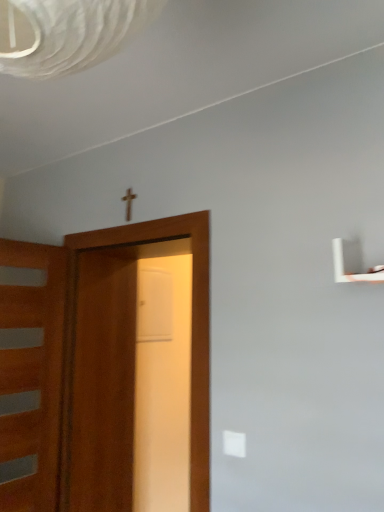
What do you see at coordinates (128, 202) in the screenshot?
I see `gold metallic crucifix at upper center` at bounding box center [128, 202].

Identify the location of gold metallic crucifix at upper center. (128, 202).

In order to click on gold metallic crucifix at upper center in this screenshot , I will do `click(128, 202)`.